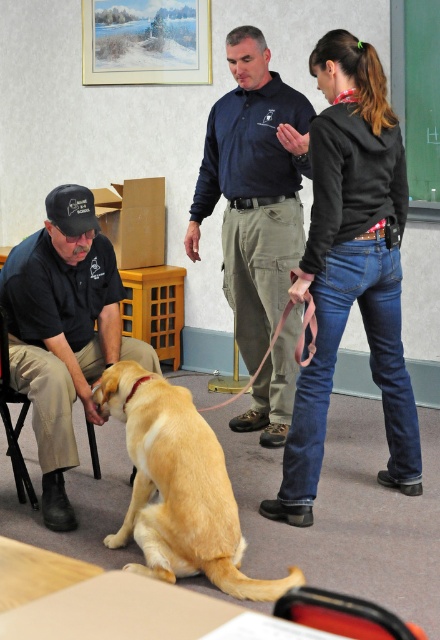
Who is lower down, black cotton hoodie at center or matte black shirt at left?

Positioned lower is matte black shirt at left.

Between black cotton hoodie at center and matte black shirt at left, which one appears on the right side from the viewer's perspective?

Positioned to the right is black cotton hoodie at center.

Does point (352, 72) come in front of point (109, 296)?

Yes.

The height and width of the screenshot is (640, 440). I want to click on black cotton hoodie at center, so click(x=351, y=268).

Does matte black shirt at left have a smaller size compared to golden fur dog at center?

Correct, matte black shirt at left occupies less space than golden fur dog at center.

Which is behind, point (76, 381) or point (140, 397)?

The point (76, 381) is behind.

Is point (52, 492) farther from viewer compared to point (118, 536)?

That is True.

The image size is (440, 640). What are the coordinates of `matte black shirt at left` in the screenshot? It's located at (63, 332).

Is point (91, 454) less distant than point (286, 305)?

No, (91, 454) is behind (286, 305).

Is point (14, 435) farther from viewer compared to point (305, 317)?

Yes.

The height and width of the screenshot is (640, 440). What do you see at coordinates (15, 422) in the screenshot?
I see `black fabric chair at left` at bounding box center [15, 422].

You are a GUI agent. You are given a task and a screenshot of the screen. Output one action in this format:
    pyautogui.click(x=<x>, y=<y>)
    Task: Click on the black fabric chair at left
    Image resolution: width=440 pixels, height=640 pixels.
    Given the screenshot: What is the action you would take?
    pyautogui.click(x=15, y=422)